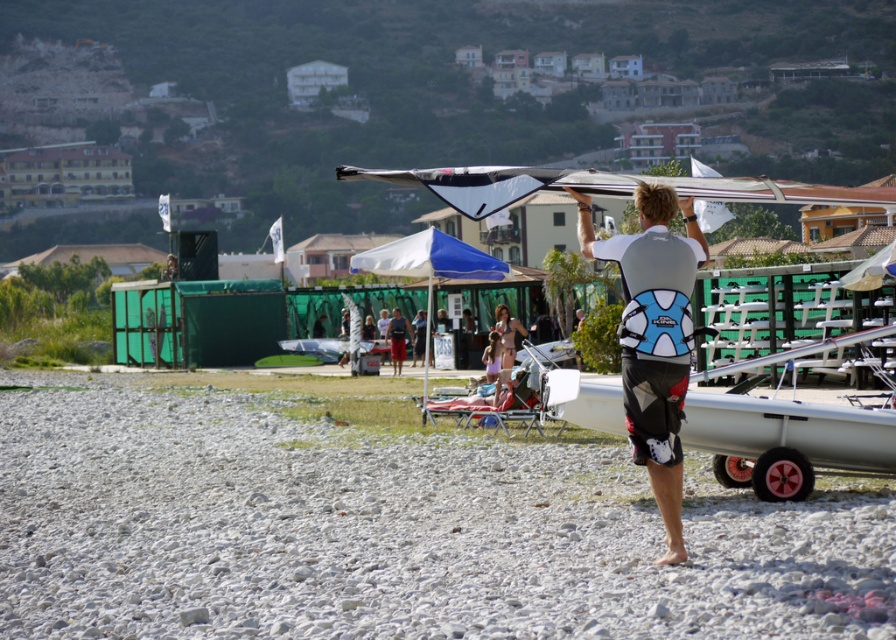
Question: Can you confirm if white matte wetsuit at center is wider than matte pink dress at center?

Choices:
 (A) yes
 (B) no

Answer: (B)

Question: Which point is farther from the camera taking this photo?

Choices:
 (A) (496, 326)
 (B) (56, 417)

Answer: (A)

Question: Does white matte wetsuit at center appear over matte pink dress at center?

Choices:
 (A) no
 (B) yes

Answer: (B)

Question: Is white gravel beach at center above white matte wetsuit at center?

Choices:
 (A) no
 (B) yes

Answer: (A)

Question: Estimate the real-world distances between objects in this image. Which object is farther from the matte pink dress at center?

Choices:
 (A) white gravel beach at center
 (B) white matte wetsuit at center

Answer: (B)

Question: Which point is farther to the camera?

Choices:
 (A) (503, 307)
 (B) (556, 493)
 (C) (645, 355)

Answer: (A)